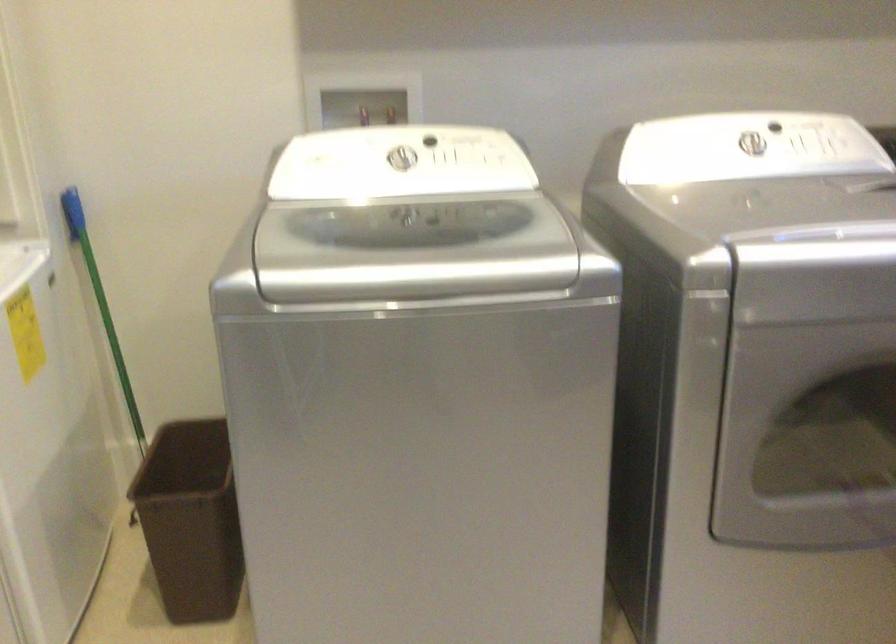
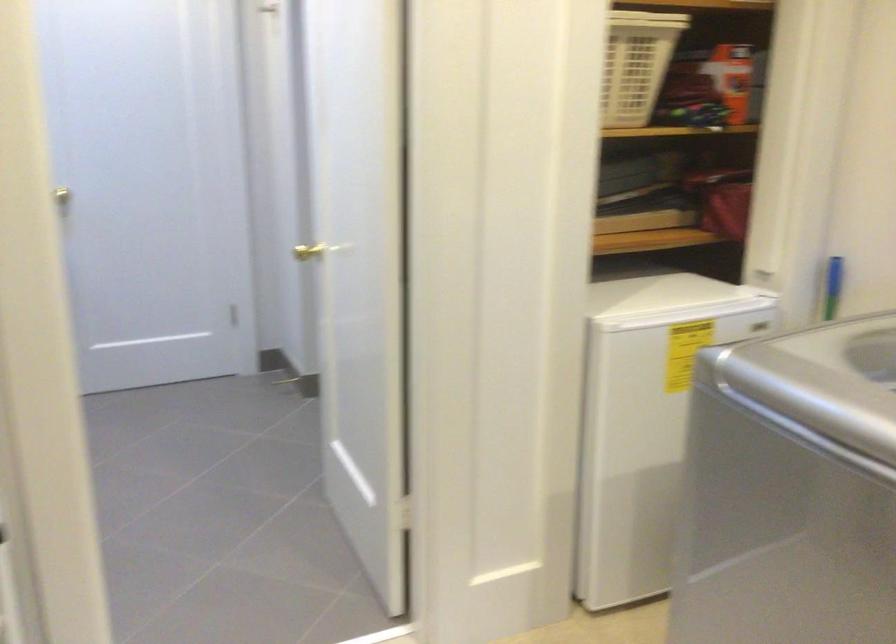
Locate, in the second image, the point that corresponds to point (359, 261) in the first image.

(823, 380)